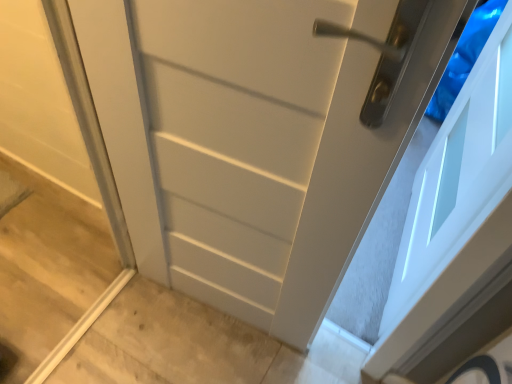
The image size is (512, 384). In order to click on white matte door at center in this screenshot , I will do `click(257, 138)`.

This screenshot has width=512, height=384. What do you see at coordinates (257, 138) in the screenshot? I see `white matte door at center` at bounding box center [257, 138].

Where is `white matte door at center`? This screenshot has width=512, height=384. white matte door at center is located at coordinates (257, 138).